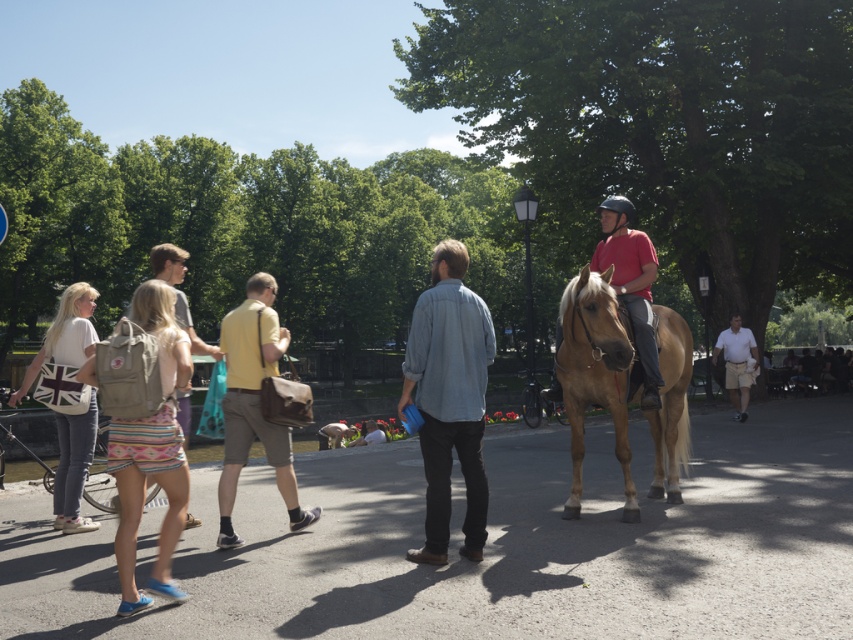
You are standing at the point closer to the viewer between point (544, 392) and point (178, 253). Which point are you at?

Point (544, 392) is further to the viewer than point (178, 253), so you are at point (544, 392).